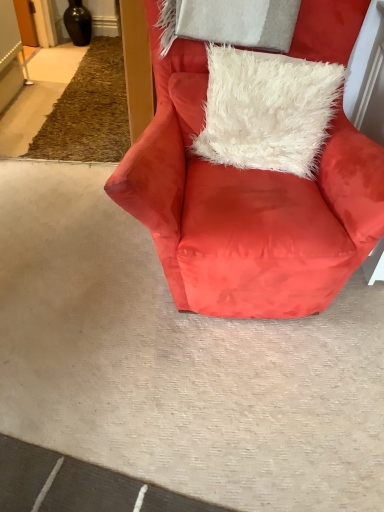
Identify the location of vacant area situated to the left side of satin red armchair at center. (61, 242).